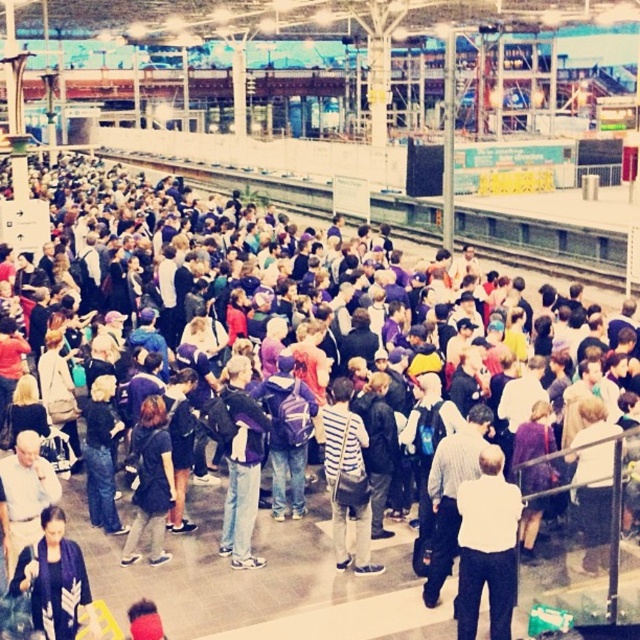
Question: Among these objects, which one is nearest to the camera?

Choices:
 (A) striped fabric shirt at center
 (B) purple fabric backpack at center
 (C) white matte shirt at center

Answer: (C)

Question: Which point is farther to the camera?

Choices:
 (A) dark blue textured jacket at lower left
 (B) purple fabric backpack at center
 (C) white matte shirt at center
 (D) dark gray sweater at center

Answer: (B)

Question: Among these objects, which one is nearest to the camera?

Choices:
 (A) striped fabric shirt at center
 (B) white matte shirt at center
 (C) purple fabric backpack at center
 (D) dark gray sweater at center

Answer: (B)

Question: Where is dark blue textured jacket at lower left located in relation to striped fabric shirt at center in the image?

Choices:
 (A) below
 (B) above

Answer: (A)

Question: Can you confirm if white matte shirt at center is smaller than dark blue textured jacket at lower left?

Choices:
 (A) yes
 (B) no

Answer: (B)

Question: In this image, where is white matte shirt at center located relative to dark gray sweater at center?

Choices:
 (A) above
 (B) below

Answer: (B)